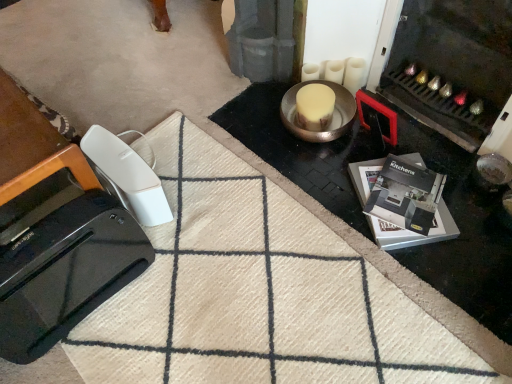
Where is `free spot to the right of black glossy kitchens brochure at lower right`? free spot to the right of black glossy kitchens brochure at lower right is located at coordinates (470, 208).